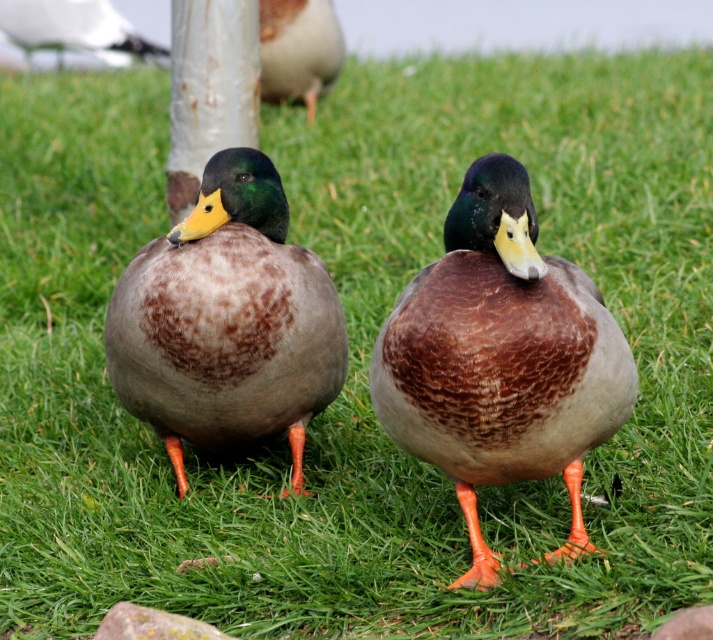
Describe the element at coordinates (297, 51) in the screenshot. Image resolution: width=713 pixels, height=640 pixels. I see `brown feathered duck at center` at that location.

Can you confirm if brown feathered duck at center is taller than white glossy seagull at upper left?

Yes, brown feathered duck at center is taller than white glossy seagull at upper left.

This screenshot has width=713, height=640. What are the coordinates of `brown feathered duck at center` in the screenshot? It's located at (297, 51).

Does brown speckled duck at center appear on the left side of white glossy seagull at upper left?

No, brown speckled duck at center is not to the left of white glossy seagull at upper left.

Who is shorter, brown speckled duck at center or white glossy seagull at upper left?

white glossy seagull at upper left

What are the coordinates of `brown speckled duck at center` in the screenshot? It's located at (225, 321).

Where is `brown speckled duck at center`? brown speckled duck at center is located at coordinates (225, 321).

Between matte brown duck at center and brown speckled duck at center, which one is positioned lower?

matte brown duck at center

Does matte brown duck at center have a greater width compared to brown speckled duck at center?

No, matte brown duck at center is not wider than brown speckled duck at center.

Describe the element at coordinates (501, 358) in the screenshot. I see `matte brown duck at center` at that location.

Locate an element on the screen. matte brown duck at center is located at coordinates (501, 358).